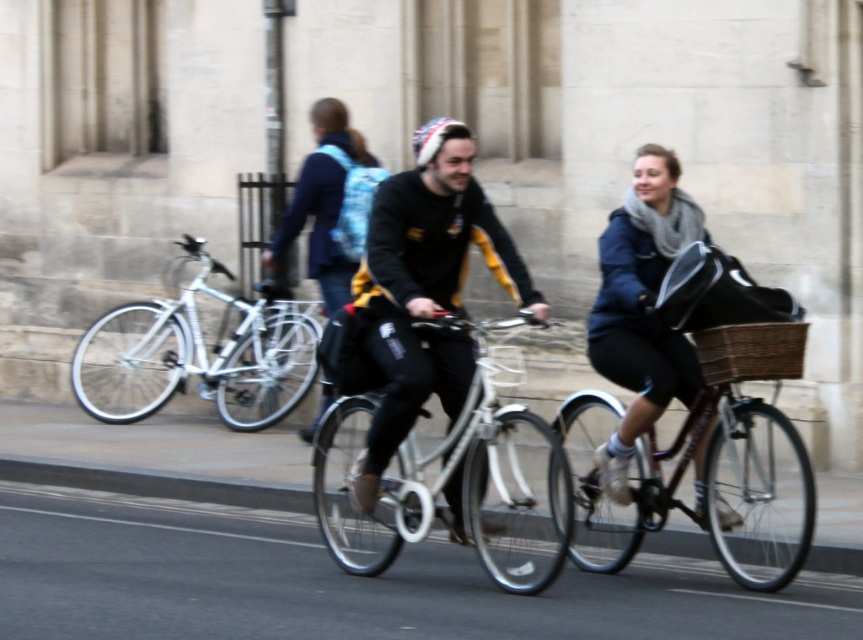
You are a delivery person who needs to carry a package that requires a space wider than the blue plaid backpack at center. Can the white matte bicycle at center provide enough space?

The white matte bicycle at center has a larger width than the blue plaid backpack at center, so it can accommodate the package needing more space.

You are a pedestrian standing at the intersection and see two cyclists approaching. The first cyclist is at point [465,385] and the second is at point [331,180]. Which cyclist is closer to you?

The cyclist at point [331,180] is closer to you because point [465,385] is in front of point [331,180], meaning the latter is nearer.

You are a delivery person who needs to quickly deliver a package to a nearby store. You see a white matte bicycle at center and a blue plaid backpack at center. Which item should you choose to ride to the store, and why?

You should choose the white matte bicycle at center to ride to the store because it is a bicycle designed for transportation, while the blue plaid backpack at center is a carrying accessory and cannot be ridden.